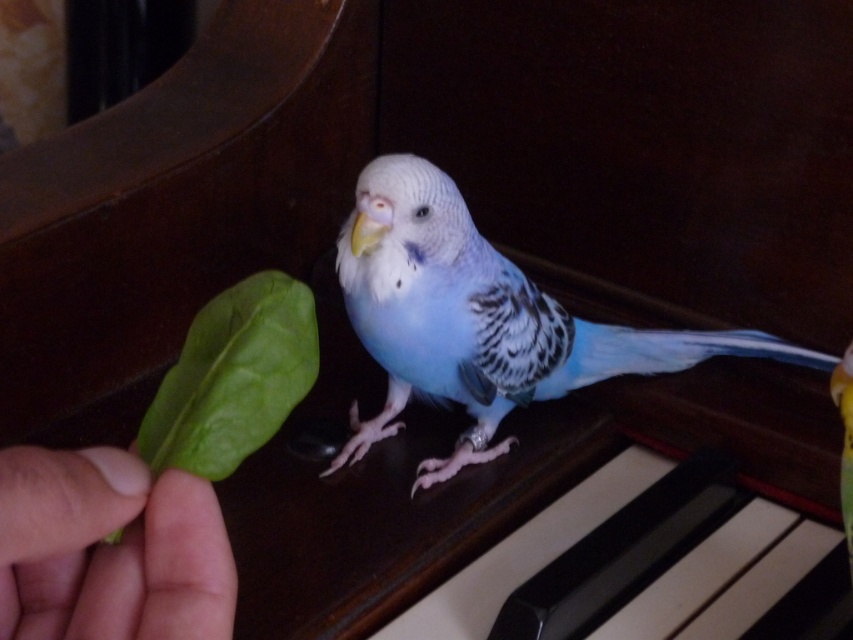
You are standing in front of the piano where the bird is perched. The green leafy at left is at point 0.859, 0.129. If you want to place the leaf closer to the bird, should you move it towards the center or the edge of the piano?

The green leafy at left is already positioned at point (109, 548). To move it closer to the bird, you should move it towards the center of the piano since the bird is likely perched on the piano surface, and the leaf is currently closer to the edge based on its coordinates.